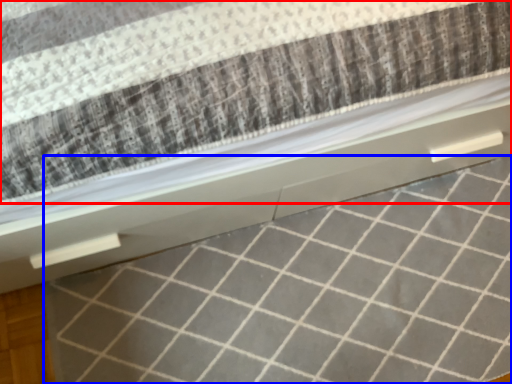
Question: Which of the following is the farthest to the observer, mattress (highlighted by a red box) or tile (highlighted by a blue box)?

Choices:
 (A) mattress
 (B) tile

Answer: (B)